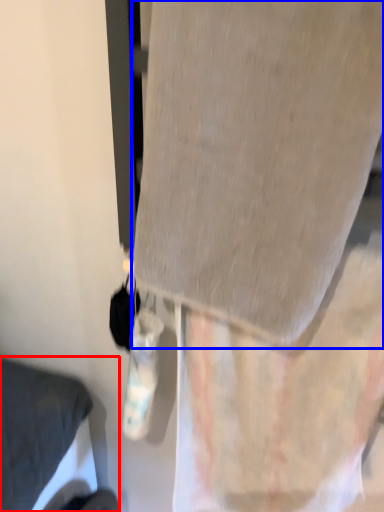
Question: Among these objects, which one is nearest to the camera, furniture (highlighted by a red box) or fabric (highlighted by a blue box)?

Choices:
 (A) furniture
 (B) fabric

Answer: (B)